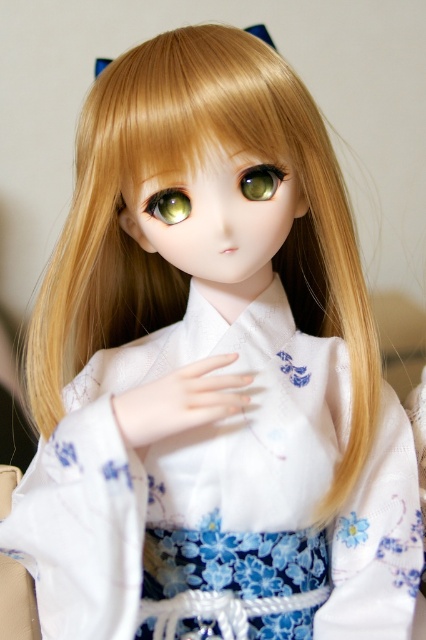
You are a photographer setting up a camera to capture the doll. The camera has a focus range of 3 inches. If you want to focus on both the green matte eye at center and the green glossy eye at center, will both eyes be in focus?

The distance between the green matte eye at center and the green glossy eye at center is 2.93 inches, which is within the camera focus range of 3 inches. Therefore, both eyes will be in focus.

Please describe the exact position of the green matte eye at center in the image using coordinates. The coordinate system has the origin at the bottom left corner of the image, with the x and y axes increasing to the right and up respectively. The maximum x and y values are both 1.0. Please provide the coordinates as a tuple of two decimal numbers rounded to three decimal places.

The green matte eye at center is located at coordinates approximately at point (261, 180).